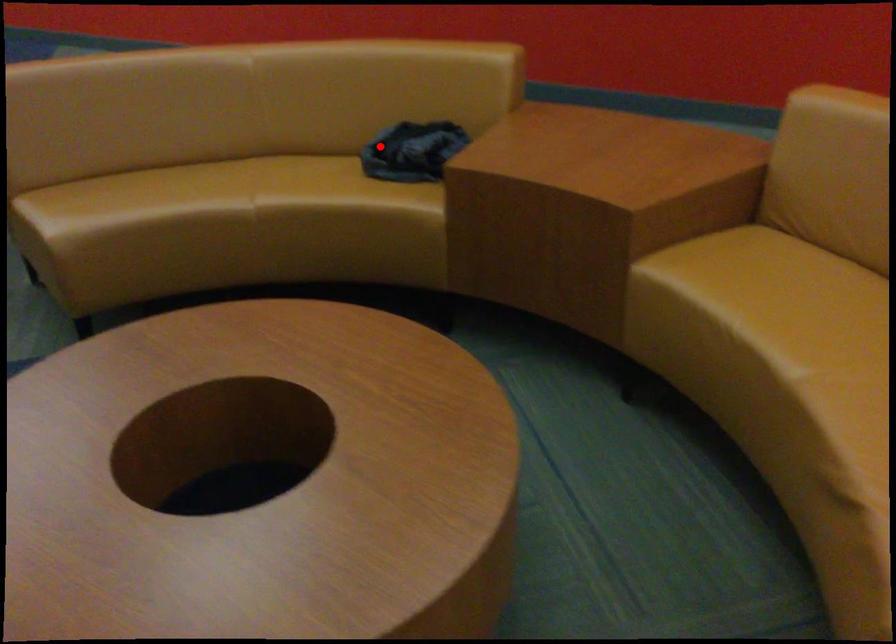
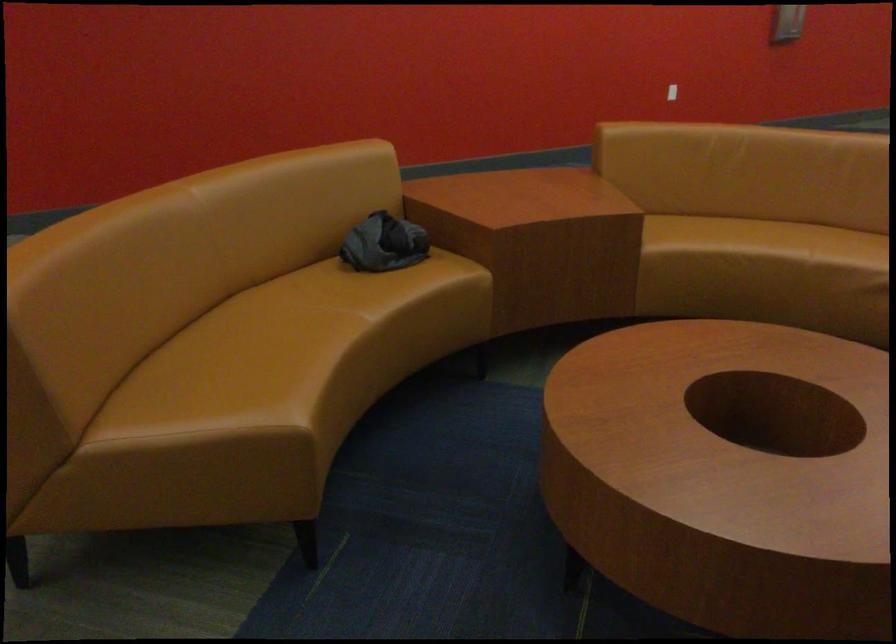
Find the pixel in the second image that matches the highlighted location in the first image.

(383, 243)